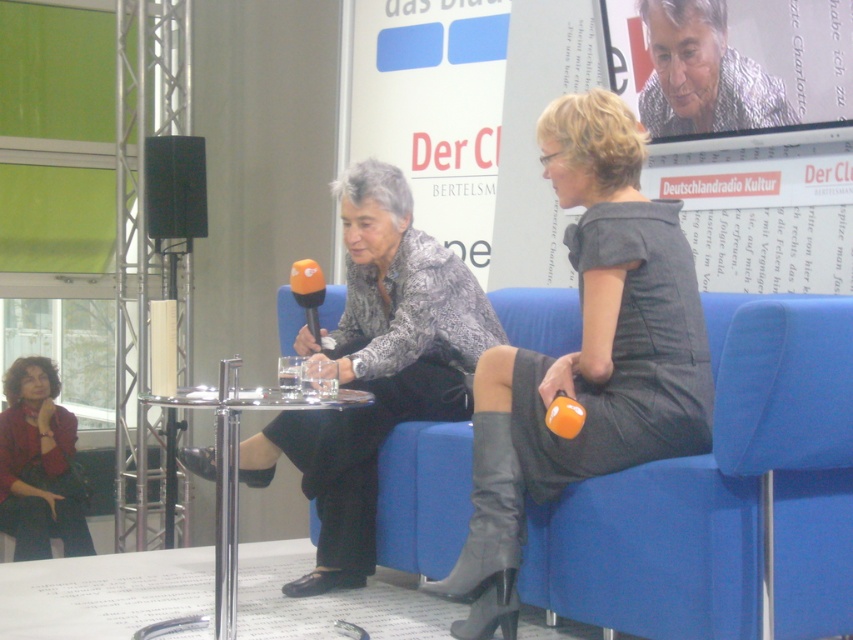
Question: Does blue fabric chair at center have a smaller size compared to patterned fabric shirt at center?

Choices:
 (A) no
 (B) yes

Answer: (B)

Question: Is patterned fabric shirt at center bigger than clear glass table at center?

Choices:
 (A) no
 (B) yes

Answer: (B)

Question: Which object appears closest to the camera in this image?

Choices:
 (A) matte gray dress at center
 (B) patterned fabric shirt at center
 (C) clear glass table at center

Answer: (C)

Question: Estimate the real-world distances between objects in this image. Which object is farther from the matte red jacket at lower left?

Choices:
 (A) textured gray sweater at center
 (B) clear glass table at center
 (C) matte gray dress at center

Answer: (A)

Question: Among these objects, which one is farthest from the camera?

Choices:
 (A) textured gray sweater at center
 (B) clear glass table at center
 (C) matte black speaker at upper left
 (D) patterned fabric shirt at center

Answer: (C)

Question: Is matte gray dress at center smaller than clear glass table at center?

Choices:
 (A) no
 (B) yes

Answer: (A)